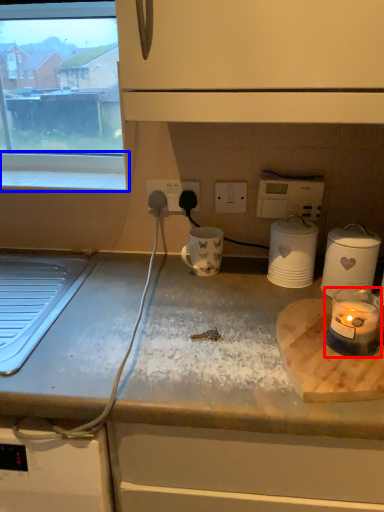
Question: Which point is further to the camera, candle holder (highlighted by a red box) or window sill (highlighted by a blue box)?

Choices:
 (A) candle holder
 (B) window sill

Answer: (B)